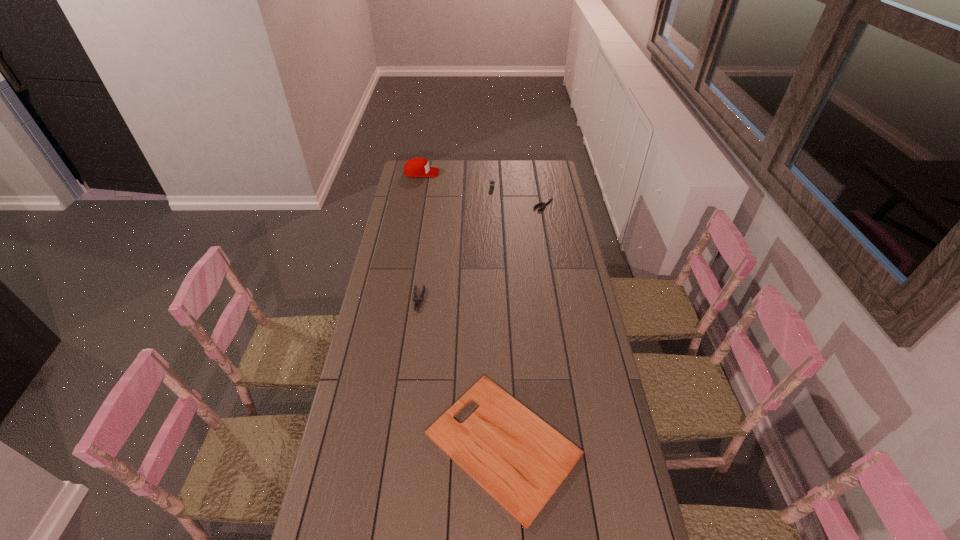
In order to click on vacant region that satisfies the following two spatial constraints: 1. at the gripping part of the nearest object; 2. on the left side of the left pliers in this screenshot , I will do `click(398, 444)`.

Where is `vacant region that satisfies the following two spatial constraints: 1. on the front-facing side of the beer can; 2. on the right side of the farthest object`? This screenshot has height=540, width=960. vacant region that satisfies the following two spatial constraints: 1. on the front-facing side of the beer can; 2. on the right side of the farthest object is located at coordinates (419, 187).

Locate an element on the screen. free location that satisfies the following two spatial constraints: 1. on the front-facing side of the farthest object; 2. on the back side of the nearest object is located at coordinates (372, 444).